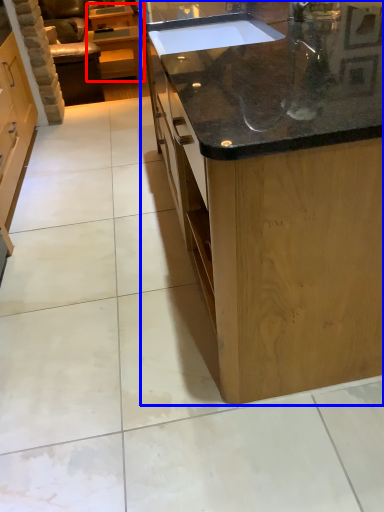
Question: Which object appears closest to the camera in this image, cabinetry (highlighted by a red box) or countertop (highlighted by a blue box)?

Choices:
 (A) cabinetry
 (B) countertop

Answer: (B)